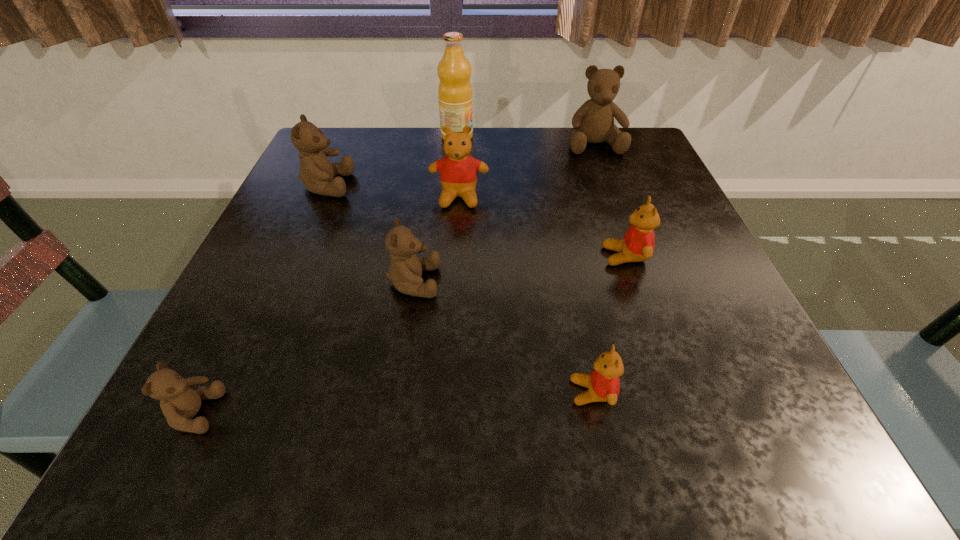
Find the location of a particular element. the nearest red teddy bear is located at coordinates (603, 383).

Find the location of a particular element. the second red teddy bear from right to left is located at coordinates (603, 383).

I want to click on the nearest brown teddy bear, so click(179, 403).

Find the location of a particular element. This screenshot has height=540, width=960. vacant space located 0.190m on the front label of the fruit juice is located at coordinates (548, 137).

Identify the location of free space located 0.080m on the front-facing side of the farthest brown teddy bear. (606, 176).

Identify the location of free region located 0.060m on the front-facing side of the second biggest brown teddy bear. (379, 185).

Find the location of a particular element. This screenshot has height=540, width=960. vacant space located on the front-facing side of the farthest red teddy bear is located at coordinates (454, 285).

This screenshot has height=540, width=960. I want to click on vacant space situated 0.190m on the front-facing side of the second smallest red teddy bear, so click(500, 256).

Locate an element on the screen. The height and width of the screenshot is (540, 960). free space located on the front-facing side of the second smallest red teddy bear is located at coordinates (472, 256).

Identify the location of free space located 0.290m on the front-facing side of the second smallest red teddy bear. The image size is (960, 540). (444, 256).